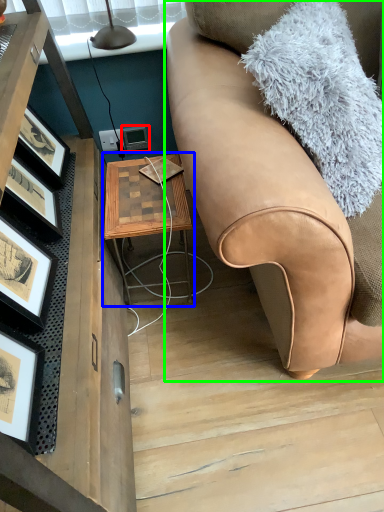
Question: Based on their relative distances, which object is farther from picture frame (highlighted by a red box)? Choose from table (highlighted by a blue box) and studio couch (highlighted by a green box).

Choices:
 (A) table
 (B) studio couch

Answer: (B)